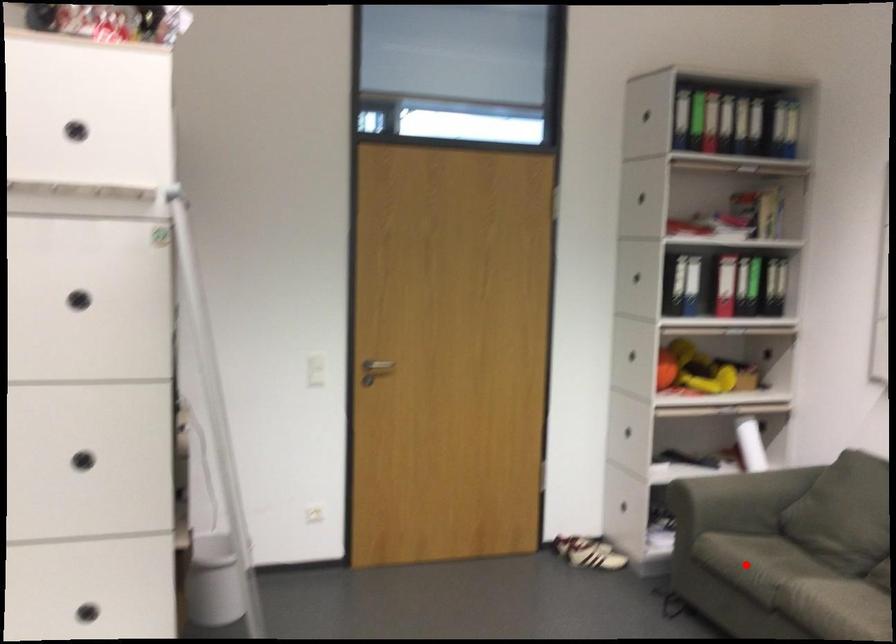
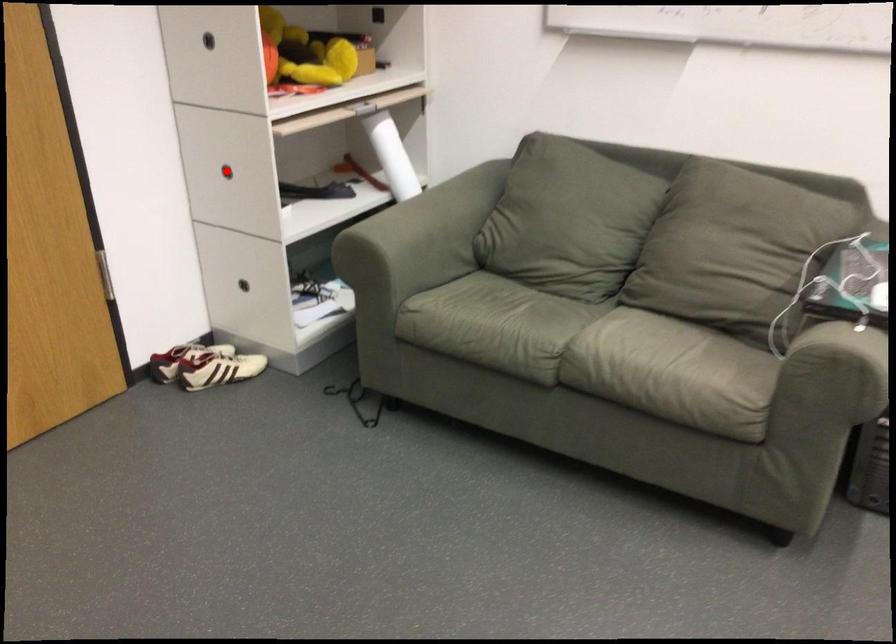
I am providing you with two images of the same scene from different viewpoints. A red point is marked on the first image and another point is marked on the second image. Is the red point in image1 aligned with the point shown in image2?

No